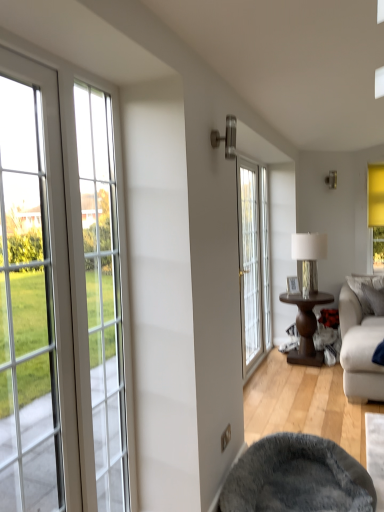
What is the approximate width of wooden picture frame at center?

wooden picture frame at center is 8.58 centimeters in width.

In order to face metallic silver lamp at center-right, should I rotate leftwards or rightwards?

Turn right by 15.634 degrees to look at metallic silver lamp at center-right.

I want to click on brown wooden table at center-right, so click(x=306, y=327).

The width and height of the screenshot is (384, 512). Describe the element at coordinates (359, 350) in the screenshot. I see `white fabric couch at lower right` at that location.

Locate an element on the screen. The height and width of the screenshot is (512, 384). wooden picture frame at center is located at coordinates (292, 285).

From the image's perspective, is gray plush bean bag chair at lower center located above or below gray fabric pillow at right?

From the image's perspective, gray plush bean bag chair at lower center appears below gray fabric pillow at right.

Considering their positions, is gray plush bean bag chair at lower center located in front of or behind gray fabric pillow at right?

In the image, gray plush bean bag chair at lower center appears in front of gray fabric pillow at right.

From a real-world perspective, between gray plush bean bag chair at lower center and gray fabric pillow at right, who is vertically lower?

gray plush bean bag chair at lower center is physically lower.

Can you tell me how much gray plush bean bag chair at lower center and white glass door at center differ in facing direction?

1.45 degrees.

Where is `bean bag chair below the white glass door at center (from the image's perspective)`? bean bag chair below the white glass door at center (from the image's perspective) is located at coordinates (297, 478).

From a real-world perspective, which object rests below the other?

From a 3D spatial view, gray plush bean bag chair at lower center is below.

Between point (327, 508) and point (239, 170), which one is positioned behind?

Positioned behind is point (239, 170).

Would you say brown wooden table at center-right contains white glass door at center?

No, white glass door at center is not surrounded by brown wooden table at center-right.

In the image, is brown wooden table at center-right on the left side or the right side of white glass door at center?

Based on their positions, brown wooden table at center-right is located to the right of white glass door at center.

Is brown wooden table at center-right facing towards white glass door at center?

No, brown wooden table at center-right is not facing towards white glass door at center.

From a real-world perspective, who is located lower, brown wooden table at center-right or white glass door at center?

brown wooden table at center-right, from a real-world perspective.

Is wooden picture frame at center not inside gray fabric pillow at right?

Yes, wooden picture frame at center is outside of gray fabric pillow at right.

From a real-world perspective, which object stands above the other?

From a 3D spatial view, wooden picture frame at center is above.

Who is bigger, wooden picture frame at center or gray fabric pillow at right?

With larger size is gray fabric pillow at right.

Is the depth of wooden picture frame at center less than that of gray fabric pillow at right?

Yes, wooden picture frame at center is closer to the viewer.

Is white glass door at center far from metallic silver lamp at center-right?

No, white glass door at center is not far away from metallic silver lamp at center-right.

Does white glass door at center have a lesser width compared to metallic silver lamp at center-right?

Correct, the width of white glass door at center is less than that of metallic silver lamp at center-right.

From the image's perspective, which one is positioned higher, white glass door at center or metallic silver lamp at center-right?

metallic silver lamp at center-right, from the image's perspective.

Is gray plush bean bag chair at lower center oriented away from wooden picture frame at center?

No, gray plush bean bag chair at lower center's orientation is not away from wooden picture frame at center.

Measure the distance between gray plush bean bag chair at lower center and wooden picture frame at center.

gray plush bean bag chair at lower center and wooden picture frame at center are 8.54 feet apart.

Considering the positions of objects gray plush bean bag chair at lower center and wooden picture frame at center in the image provided, who is more to the left, gray plush bean bag chair at lower center or wooden picture frame at center?

gray plush bean bag chair at lower center is more to the left.

Is gray plush bean bag chair at lower center placed right next to wooden picture frame at center?

No, gray plush bean bag chair at lower center is not making contact with wooden picture frame at center.

In the scene shown: Considering the sizes of objects brown wooden table at center-right and gray plush bean bag chair at lower center in the image provided, who is bigger, brown wooden table at center-right or gray plush bean bag chair at lower center?

brown wooden table at center-right.

Based on the photo, are brown wooden table at center-right and gray plush bean bag chair at lower center beside each other?

No, brown wooden table at center-right is not next to gray plush bean bag chair at lower center.

From a real-world perspective, is brown wooden table at center-right on gray plush bean bag chair at lower center?

Correct, in the physical world, brown wooden table at center-right is higher than gray plush bean bag chair at lower center.

Is brown wooden table at center-right in front of gray plush bean bag chair at lower center?

No, brown wooden table at center-right is behind gray plush bean bag chair at lower center.

You are a GUI agent. You are given a task and a screenshot of the screen. Output one action in this format:
    pyautogui.click(x=<x>, y=<y>)
    Task: Click on the pillow located above the gray plush bean bag chair at lower center (from the image's perspective)
    
    Given the screenshot: What is the action you would take?
    pyautogui.click(x=362, y=291)

Where is `bean bag chair that is below the white glass door at center (from the image's perspective)`? The image size is (384, 512). bean bag chair that is below the white glass door at center (from the image's perspective) is located at coordinates (297, 478).

Looking at the image, which one is located further to white glass door at center, gray fabric pillow at right or brown wooden table at center-right?

gray fabric pillow at right is further to white glass door at center.

When comparing their distances from white fabric couch at lower right, does gray plush bean bag chair at lower center or gray fabric pillow at right seem closer?

gray fabric pillow at right is positioned closer to the anchor white fabric couch at lower right.

When comparing their distances from wooden picture frame at center, does gray plush bean bag chair at lower center or gray fabric pillow at right seem further?

Among the two, gray plush bean bag chair at lower center is located further to wooden picture frame at center.

Based on their spatial positions, is white glass door at center or white fabric couch at lower right further from wooden picture frame at center?

Among the two, white fabric couch at lower right is located further to wooden picture frame at center.

In the scene shown: From the image, which object appears to be farther from brown wooden table at center-right, gray plush bean bag chair at lower center or white glass door at center?

gray plush bean bag chair at lower center lies further to brown wooden table at center-right than the other object.

Which object lies further to the anchor point white glass door at center, gray plush bean bag chair at lower center or brown wooden table at center-right?

gray plush bean bag chair at lower center.

Based on the photo, which object lies nearer to the anchor point wooden picture frame at center, metallic silver lamp at center-right or white fabric couch at lower right?

metallic silver lamp at center-right is closer to wooden picture frame at center.

Which object lies nearer to the anchor point metallic silver lamp at center-right, brown wooden table at center-right or wooden picture frame at center?

wooden picture frame at center is positioned closer to the anchor metallic silver lamp at center-right.

You are a GUI agent. You are given a task and a screenshot of the screen. Output one action in this format:
    pyautogui.click(x=<x>, y=<y>)
    Task: Click on the table positioned between white glass door at center and wooden picture frame at center from near to far
    
    Given the screenshot: What is the action you would take?
    coord(306,327)

I want to click on lamp located between gray plush bean bag chair at lower center and gray fabric pillow at right in the depth direction, so click(308, 257).

At what (x,y) coordinates should I click in order to perform the action: click on table located between white glass door at center and white fabric couch at lower right in the left-right direction. Please return your answer as a coordinate pair (x, y). Looking at the image, I should click on (306, 327).

Image resolution: width=384 pixels, height=512 pixels. In order to click on studio couch positioned between gray plush bean bag chair at lower center and white glass door at center from near to far in this screenshot , I will do `click(359, 350)`.